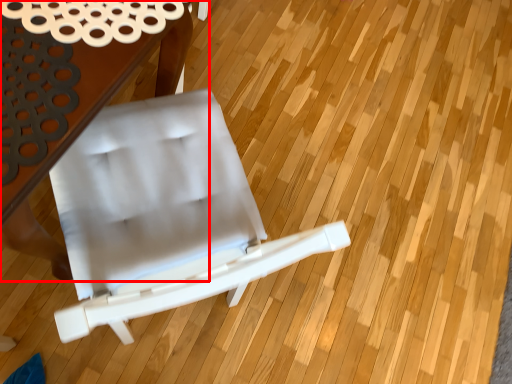
Question: From the image's perspective, considering the relative positions of table (annotated by the red box) and chair in the image provided, where is table (annotated by the red box) located with respect to the staircase?

Choices:
 (A) below
 (B) above

Answer: (B)